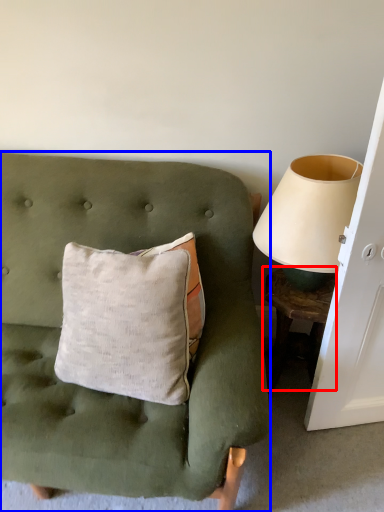
Question: Which object appears closest to the camera in this image, table (highlighted by a red box) or furniture (highlighted by a blue box)?

Choices:
 (A) table
 (B) furniture

Answer: (B)